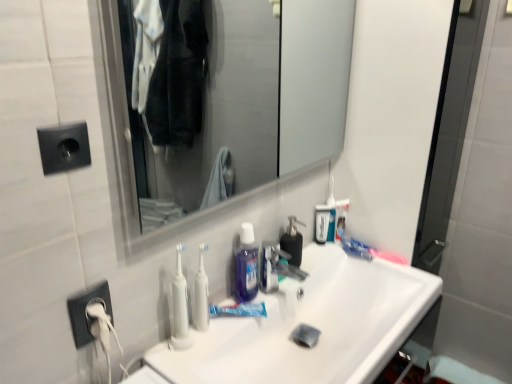
Find the location of `vacant area that lies between transparent plastic mouthwash at center, the 3th mouthwash positioned from the front, and black matte soap dispenser at center`. vacant area that lies between transparent plastic mouthwash at center, the 3th mouthwash positioned from the front, and black matte soap dispenser at center is located at coordinates (313, 254).